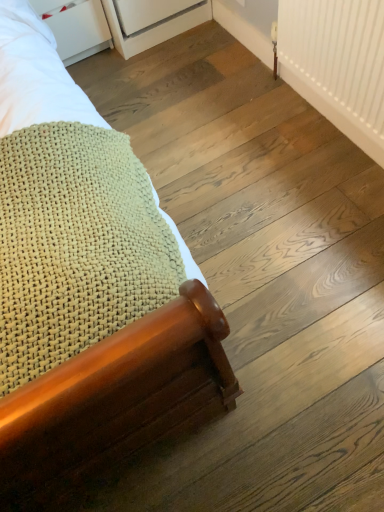
Question: Should I look upward or downward to see white plastic radiator at upper right?

Choices:
 (A) up
 (B) down

Answer: (A)

Question: From the image's perspective, is wooden bed frame at lower left located beneath white matte drawer at upper left?

Choices:
 (A) yes
 (B) no

Answer: (A)

Question: From the image's perspective, would you say wooden bed frame at lower left is positioned over white matte drawer at upper left?

Choices:
 (A) no
 (B) yes

Answer: (A)

Question: Can you confirm if wooden bed frame at lower left is smaller than white matte drawer at upper left?

Choices:
 (A) no
 (B) yes

Answer: (A)

Question: Is wooden bed frame at lower left not close to white matte drawer at upper left?

Choices:
 (A) no
 (B) yes

Answer: (A)

Question: Is wooden bed frame at lower left facing away from white matte drawer at upper left?

Choices:
 (A) no
 (B) yes

Answer: (A)

Question: Is wooden bed frame at lower left with white matte drawer at upper left?

Choices:
 (A) no
 (B) yes

Answer: (A)

Question: From the image's perspective, is white matte drawer at upper left located beneath wooden bed frame at lower left?

Choices:
 (A) no
 (B) yes

Answer: (A)

Question: Does white matte drawer at upper left have a smaller size compared to wooden bed frame at lower left?

Choices:
 (A) no
 (B) yes

Answer: (B)

Question: Does white matte drawer at upper left have a lesser height compared to wooden bed frame at lower left?

Choices:
 (A) no
 (B) yes

Answer: (B)

Question: Can you see white matte drawer at upper left touching wooden bed frame at lower left?

Choices:
 (A) no
 (B) yes

Answer: (A)

Question: Is white matte drawer at upper left thinner than wooden bed frame at lower left?

Choices:
 (A) yes
 (B) no

Answer: (A)

Question: Is wooden bed frame at lower left surrounded by white matte drawer at upper left?

Choices:
 (A) yes
 (B) no

Answer: (B)

Question: Would you say wooden bed frame at lower left is a long distance from white plastic radiator at upper right?

Choices:
 (A) yes
 (B) no

Answer: (B)